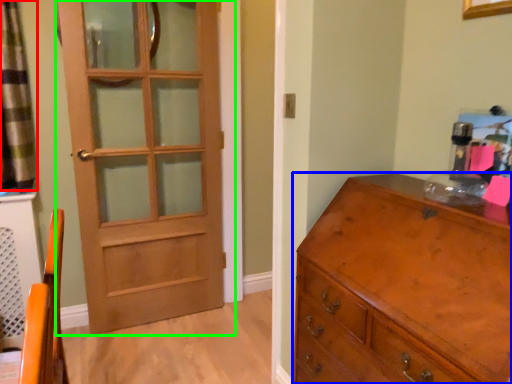
Question: Which object is positioned farthest from curtain (highlighted by a red box)? Select from chest of drawers (highlighted by a blue box) and door (highlighted by a green box).

Choices:
 (A) chest of drawers
 (B) door

Answer: (A)